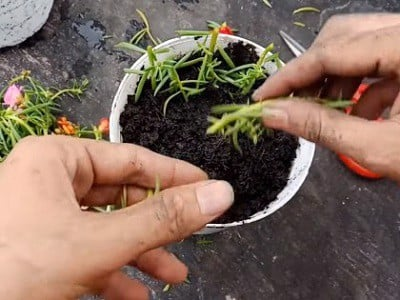
Locate an element on the screen. cup is located at coordinates (284, 209).